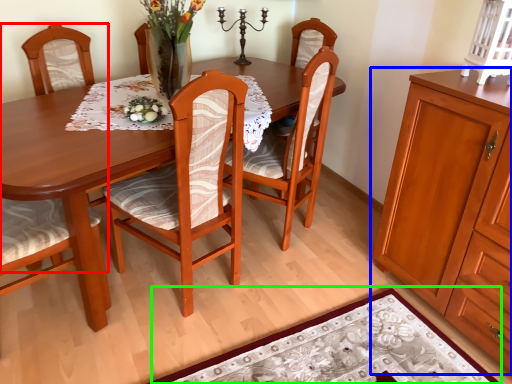
Question: Based on their relative distances, which object is farther from chair (highlighted by a red box)? Choose from cabinetry (highlighted by a blue box) and place mat (highlighted by a green box).

Choices:
 (A) cabinetry
 (B) place mat

Answer: (A)